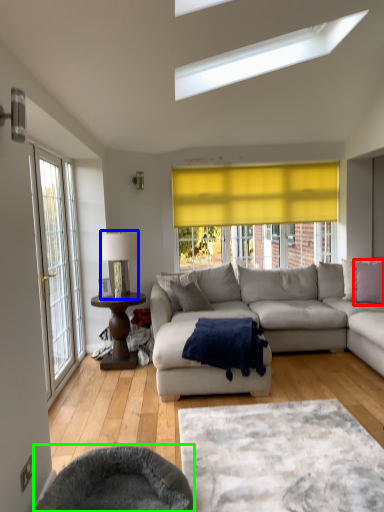
Question: Which is farther away from pillow (highlighted by a red box)? table lamp (highlighted by a blue box) or swivel chair (highlighted by a green box)?

Choices:
 (A) table lamp
 (B) swivel chair

Answer: (B)